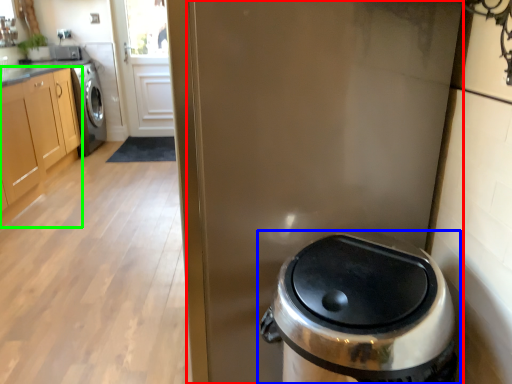
Question: Considering the real-world distances, which object is farthest from screen door (highlighted by a red box)? waste container (highlighted by a blue box) or cabinetry (highlighted by a green box)?

Choices:
 (A) waste container
 (B) cabinetry

Answer: (B)